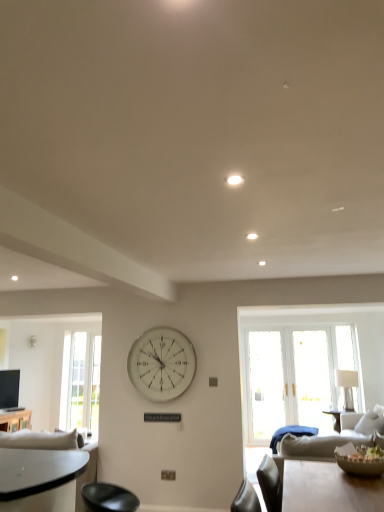
Question: From the image's perspective, is clear glass door at left located above or below wooden table at lower left?

Choices:
 (A) above
 (B) below

Answer: (A)

Question: From a real-world perspective, is clear glass door at left physically located above or below wooden table at lower left?

Choices:
 (A) above
 (B) below

Answer: (A)

Question: Which object is the closest to the white fabric couch at lower left?

Choices:
 (A) wooden table at lower left
 (B) clear glass door at left
 (C) white fabric lampshade at right
 (D) white glossy light at upper center
 (E) white glass clock at center

Answer: (E)

Question: Considering the real-world distances, which object is farthest from the clear glass door at left?

Choices:
 (A) white glossy light at upper center
 (B) white fabric couch at lower left
 (C) wooden table at lower left
 (D) white glass clock at center
 (E) white fabric lampshade at right

Answer: (A)